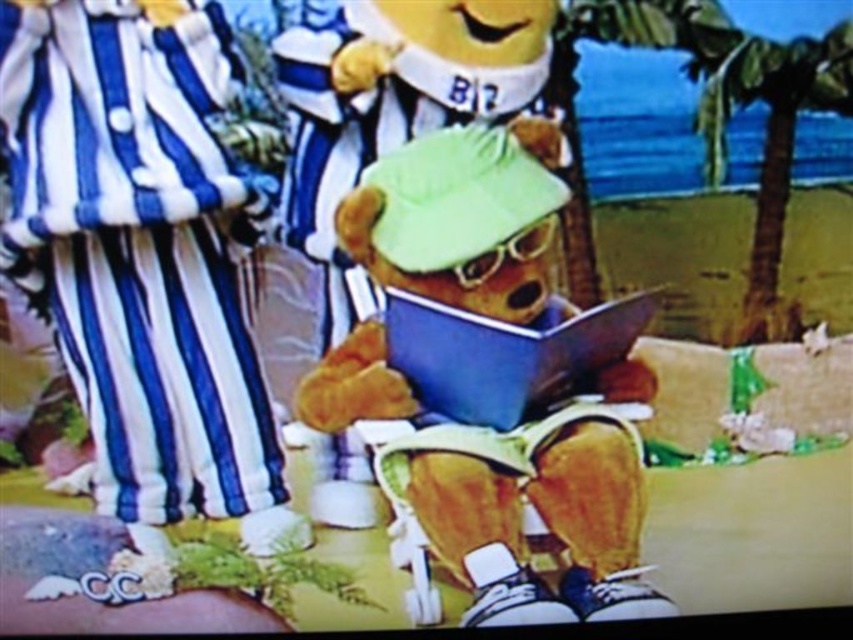
You are an animator working on a scene where the blue matte book at center needs to be placed under the green leafy palm tree at upper right. Based on their sizes, will the book fit underneath without needing to adjust its position?

The green leafy palm tree at upper right is taller than the blue matte book at center, so the book will fit underneath without needing adjustments as it is shorter in height.

You are a photographer trying to capture a clear photo of the fluffy brown teddy bear at center and the blue matte book at center. Since the bear is blocking the book, can you adjust your position to see both objects without moving them?

The fluffy brown teddy bear at center is in front of the blue matte book at center, so you can move your position slightly to the side to see both objects without moving them.